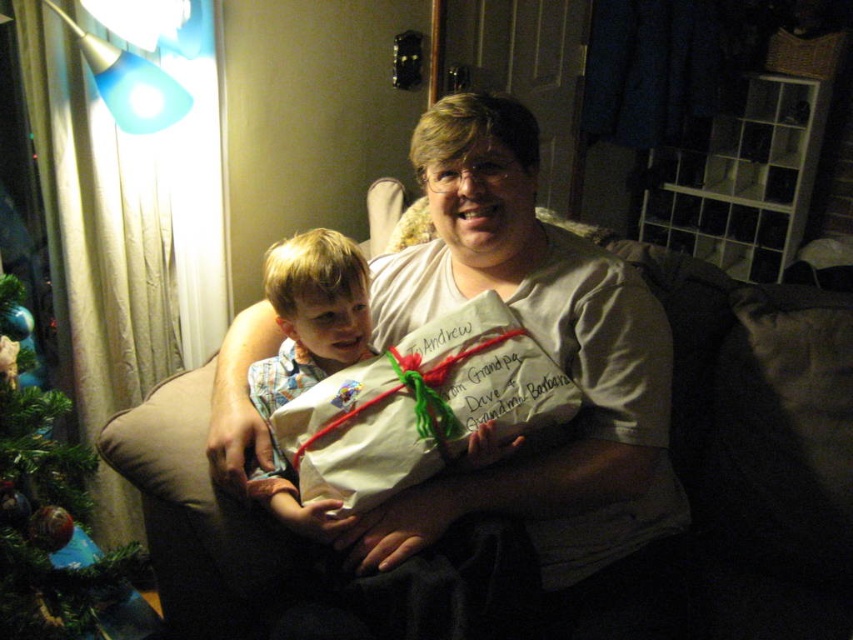
Question: Based on their relative distances, which object is nearer to the light brown fabric shirt at center?

Choices:
 (A) green matte christmas tree at left
 (B) white paper gift at center

Answer: (B)

Question: Which point is farther from the camera taking this photo?

Choices:
 (A) (776, 528)
 (B) (554, 419)
 (C) (347, 289)

Answer: (A)

Question: Where is white paper gift at center located in relation to light brown fabric shirt at center in the image?

Choices:
 (A) right
 (B) left

Answer: (A)

Question: Where is white paper gift at center located in relation to green matte christmas tree at left in the image?

Choices:
 (A) below
 (B) above

Answer: (B)

Question: Which point is closer to the camera?

Choices:
 (A) (132, 435)
 (B) (445, 333)

Answer: (B)

Question: Is white paper gift at center above green matte christmas tree at left?

Choices:
 (A) yes
 (B) no

Answer: (A)